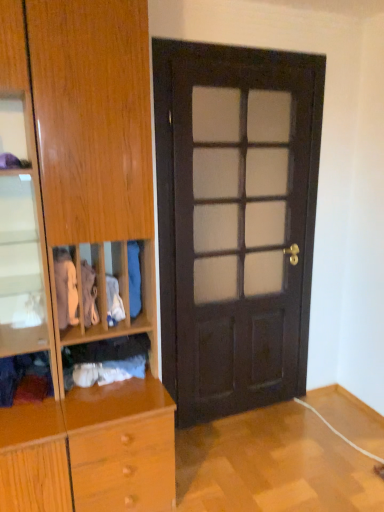
At what (x,y) coordinates should I click in order to perform the action: click on dark wood door at center. Please return your answer as a coordinate pair (x, y). The image size is (384, 512). Looking at the image, I should click on (235, 222).

The width and height of the screenshot is (384, 512). What do you see at coordinates (23, 374) in the screenshot?
I see `velvet purple scarf at lower left, placed as the 1th clothing when sorted from left to right` at bounding box center [23, 374].

At what (x,y) coordinates should I click in order to perform the action: click on white cotton shirt at left, which appears as the 2th clothing when viewed from the left. Please return your answer as a coordinate pair (x, y). This screenshot has width=384, height=512. Looking at the image, I should click on point(65,288).

This screenshot has height=512, width=384. Find the location of `white cotton shirt at center, which is the fifth clothing from left to right`. white cotton shirt at center, which is the fifth clothing from left to right is located at coordinates (114, 302).

Considering the relative positions of white cotton shirt at left, which is the fifth clothing from right to left, and velvet purple scarf at lower left, the sixth clothing viewed from the right, in the image provided, is white cotton shirt at left, which is the fifth clothing from right to left, to the right of velvet purple scarf at lower left, the sixth clothing viewed from the right, from the viewer's perspective?

Yes, white cotton shirt at left, which is the fifth clothing from right to left, is to the right of velvet purple scarf at lower left, the sixth clothing viewed from the right.

Where is `clothing in front of the white cotton shirt at left, which is the fifth clothing from right to left`? clothing in front of the white cotton shirt at left, which is the fifth clothing from right to left is located at coordinates (23, 374).

From the image's perspective, between white cotton shirt at left, which is the fifth clothing from right to left, and velvet purple scarf at lower left, the sixth clothing viewed from the right, who is located below?

velvet purple scarf at lower left, the sixth clothing viewed from the right, is shown below in the image.

Which of these two, white cotton shirt at left, which appears as the 2th clothing when viewed from the left, or velvet purple scarf at lower left, the sixth clothing viewed from the right, is wider?

With larger width is velvet purple scarf at lower left, the sixth clothing viewed from the right.

Find the location of `door on the right side of white fabric at left, which is the 3th clothing in left-to-right order`. door on the right side of white fabric at left, which is the 3th clothing in left-to-right order is located at coordinates (235, 222).

Considering the positions of point (218, 291) and point (88, 273), is point (218, 291) closer or farther from the camera than point (88, 273)?

Point (218, 291) is positioned farther from the camera compared to point (88, 273).

Considering the relative positions of dark wood door at center and white fabric at left, which is the 3th clothing in left-to-right order, in the image provided, is dark wood door at center to the left or to the right of white fabric at left, which is the 3th clothing in left-to-right order,?

Based on their positions, dark wood door at center is located to the right of white fabric at left, which is the 3th clothing in left-to-right order.

Considering the relative sizes of dark wood door at center and white fabric at left, which is the 3th clothing in left-to-right order, in the image provided, is dark wood door at center shorter than white fabric at left, which is the 3th clothing in left-to-right order,?

In fact, dark wood door at center may be taller than white fabric at left, which is the 3th clothing in left-to-right order.

Who is bigger, velvet purple scarf at lower left, the sixth clothing viewed from the right, or blue fabric at center, the sixth clothing from the left?

velvet purple scarf at lower left, the sixth clothing viewed from the right.

What's the angular difference between velvet purple scarf at lower left, the sixth clothing viewed from the right, and blue fabric at center, the sixth clothing from the left,'s facing directions?

They differ by 0.000599 degrees in their facing directions.

Does velvet purple scarf at lower left, the sixth clothing viewed from the right, have a greater width compared to blue fabric at center, the 1th clothing positioned from the right?

Yes, velvet purple scarf at lower left, the sixth clothing viewed from the right, is wider than blue fabric at center, the 1th clothing positioned from the right.

From a real-world perspective, is velvet purple scarf at lower left, placed as the 1th clothing when sorted from left to right, positioned above or below blue fabric at center, the sixth clothing from the left?

velvet purple scarf at lower left, placed as the 1th clothing when sorted from left to right, is below blue fabric at center, the sixth clothing from the left.

From the image's perspective, is white cotton shirt at left, which appears as the 2th clothing when viewed from the left, below wooden cabinet at left?

Yes.

Are white cotton shirt at left, which appears as the 2th clothing when viewed from the left, and wooden cabinet at left far apart?

white cotton shirt at left, which appears as the 2th clothing when viewed from the left, is near wooden cabinet at left, not far away.

Is white cotton shirt at left, which is the fifth clothing from right to left, closer to the viewer compared to wooden cabinet at left?

No, white cotton shirt at left, which is the fifth clothing from right to left, is further to the viewer.

Based on the photo, which is closer to the camera, (x=57, y=297) or (x=15, y=77)?

Point (x=57, y=297) is positioned farther from the camera compared to point (x=15, y=77).

Is blue fabric at center, the sixth clothing from the left, bigger than velvet purple scarf at lower left, the sixth clothing viewed from the right?

Actually, blue fabric at center, the sixth clothing from the left, might be smaller than velvet purple scarf at lower left, the sixth clothing viewed from the right.

Is blue fabric at center, the sixth clothing from the left, not within velvet purple scarf at lower left, the sixth clothing viewed from the right?

Yes, blue fabric at center, the sixth clothing from the left, is located beyond the bounds of velvet purple scarf at lower left, the sixth clothing viewed from the right.

Is blue fabric at center, the 1th clothing positioned from the right, positioned with its back to velvet purple scarf at lower left, the sixth clothing viewed from the right?

No.

From the image's perspective, is blue fabric at center, the 1th clothing positioned from the right, below velvet purple scarf at lower left, the sixth clothing viewed from the right?

Incorrect, from the image's perspective, blue fabric at center, the 1th clothing positioned from the right, is higher than velvet purple scarf at lower left, the sixth clothing viewed from the right.

From a real-world perspective, is white cotton shirt at left, which is the fifth clothing from right to left, physically located above or below blue fabric at center, the sixth clothing from the left?

In terms of real-world spatial position, white cotton shirt at left, which is the fifth clothing from right to left, is below blue fabric at center, the sixth clothing from the left.

Consider the image. From the image's perspective, is white cotton shirt at left, which appears as the 2th clothing when viewed from the left, on blue fabric at center, the sixth clothing from the left?

No, from the image's perspective, white cotton shirt at left, which appears as the 2th clothing when viewed from the left, is not on top of blue fabric at center, the sixth clothing from the left.

From the image's perspective, which clothing is the 1st one below the blue fabric at center, the 1th clothing positioned from the right? Please provide its 2D coordinates.

[(65, 288)]

Does point (63, 290) lie in front of point (130, 295)?

Yes, it is.

From a real-world perspective, is blue fabric at center, the 1th clothing positioned from the right, positioned above or below white cotton shirt at left, which is the fifth clothing from right to left?

Clearly, from a real-world perspective, blue fabric at center, the 1th clothing positioned from the right, is above white cotton shirt at left, which is the fifth clothing from right to left.

Consider the image. From the image's perspective, which one is positioned higher, blue fabric at center, the 1th clothing positioned from the right, or white cotton shirt at left, which appears as the 2th clothing when viewed from the left?

blue fabric at center, the 1th clothing positioned from the right.

In the scene shown: Is blue fabric at center, the sixth clothing from the left, closer to the viewer compared to white cotton shirt at left, which is the fifth clothing from right to left?

No, blue fabric at center, the sixth clothing from the left, is behind white cotton shirt at left, which is the fifth clothing from right to left.

The image size is (384, 512). What are the coordinates of `clothing that is the 3rd object located above the velvet purple scarf at lower left, placed as the 1th clothing when sorted from left to right (from the image's perspective)` in the screenshot? It's located at (65, 288).

The width and height of the screenshot is (384, 512). I want to click on door located on the right of white fabric at left, which is counted as the 4th clothing, starting from the right, so click(235, 222).

When comparing their distances from blue fabric at center, the 1th clothing positioned from the right, does dark wood door at center or velvet purple scarf at lower left, the sixth clothing viewed from the right, seem closer?

The object closer to blue fabric at center, the 1th clothing positioned from the right, is velvet purple scarf at lower left, the sixth clothing viewed from the right.

From the image, which object appears to be farther from white cotton socks at lower center, which appears as the third clothing when viewed from the right, blue fabric at center, the sixth clothing from the left, or white cotton shirt at center, the 2th clothing positioned from the right?

blue fabric at center, the sixth clothing from the left, is further to white cotton socks at lower center, which appears as the third clothing when viewed from the right.

When comparing their distances from white cotton shirt at left, which is the fifth clothing from right to left, does velvet purple scarf at lower left, placed as the 1th clothing when sorted from left to right, or white cotton socks at lower center, which appears as the third clothing when viewed from the right, seem further?

The object further to white cotton shirt at left, which is the fifth clothing from right to left, is velvet purple scarf at lower left, placed as the 1th clothing when sorted from left to right.

Looking at the image, which one is located further to white cotton shirt at center, which is the fifth clothing from left to right, white cotton socks at lower center, which appears as the third clothing when viewed from the right, or velvet purple scarf at lower left, the sixth clothing viewed from the right?

Among the two, velvet purple scarf at lower left, the sixth clothing viewed from the right, is located further to white cotton shirt at center, which is the fifth clothing from left to right.

Estimate the real-world distances between objects in this image. Which object is further from blue fabric at center, the sixth clothing from the left, velvet purple scarf at lower left, placed as the 1th clothing when sorted from left to right, or white cotton shirt at center, the 2th clothing positioned from the right?

velvet purple scarf at lower left, placed as the 1th clothing when sorted from left to right, is further to blue fabric at center, the sixth clothing from the left.

Looking at the image, which one is located further to white fabric at left, which is the 3th clothing in left-to-right order, white cotton socks at lower center, which is the fourth clothing from left to right, or blue fabric at center, the 1th clothing positioned from the right?

white cotton socks at lower center, which is the fourth clothing from left to right.

When comparing their distances from white cotton shirt at left, which is the fifth clothing from right to left, does velvet purple scarf at lower left, placed as the 1th clothing when sorted from left to right, or blue fabric at center, the 1th clothing positioned from the right, seem further?

velvet purple scarf at lower left, placed as the 1th clothing when sorted from left to right, is further to white cotton shirt at left, which is the fifth clothing from right to left.

From the picture: Estimate the real-world distances between objects in this image. Which object is closer to white fabric at left, which is the 3th clothing in left-to-right order, blue fabric at center, the 1th clothing positioned from the right, or dark wood door at center?

blue fabric at center, the 1th clothing positioned from the right, lies closer to white fabric at left, which is the 3th clothing in left-to-right order, than the other object.

Image resolution: width=384 pixels, height=512 pixels. Identify the location of cabinetry between white cotton shirt at left, which appears as the 2th clothing when viewed from the left, and dark wood door at center, in the horizontal direction. (78, 251).

At what (x,y) coordinates should I click in order to perform the action: click on cabinetry located between velvet purple scarf at lower left, the sixth clothing viewed from the right, and dark wood door at center in the left-right direction. Please return your answer as a coordinate pair (x, y). The height and width of the screenshot is (512, 384). Looking at the image, I should click on (78, 251).

In order to click on clothing positioned between wooden cabinet at left and white cotton shirt at left, which appears as the 2th clothing when viewed from the left, from near to far in this screenshot , I will do `click(23, 374)`.

Identify the location of clothing situated between white cotton shirt at center, the 2th clothing positioned from the right, and dark wood door at center from left to right. The image size is (384, 512). 134,278.